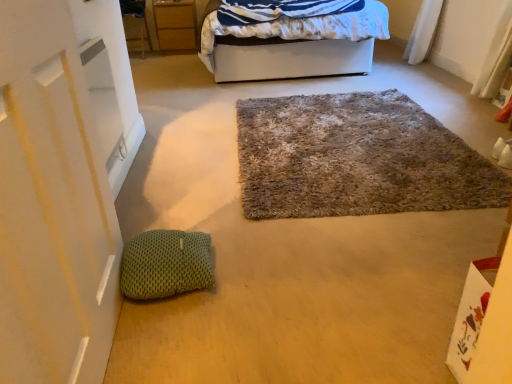
The height and width of the screenshot is (384, 512). Describe the element at coordinates (292, 45) in the screenshot. I see `white fabric bed at upper center` at that location.

You are a GUI agent. You are given a task and a screenshot of the screen. Output one action in this format:
    pyautogui.click(x=<x>, y=<y>)
    Task: Click on the white fabric bed at upper center
    
    Given the screenshot: What is the action you would take?
    pyautogui.click(x=292, y=45)

Image resolution: width=512 pixels, height=384 pixels. In order to click on bed above the green knitted pillow at lower left (from a real-world perspective) in this screenshot , I will do `click(292, 45)`.

Consider the image. Is white fabric bed at upper center beside green knitted pillow at lower left?

white fabric bed at upper center and green knitted pillow at lower left are clearly separated.

Could you tell me if white fabric bed at upper center is facing green knitted pillow at lower left?

Yes.

In the scene shown: Who is bigger, white fabric bed at upper center or green knitted pillow at lower left?

Bigger between the two is white fabric bed at upper center.

Are green knitted pillow at lower left and matte wood cabinet at upper left far apart?

Yes, green knitted pillow at lower left and matte wood cabinet at upper left are located far from each other.

You are a GUI agent. You are given a task and a screenshot of the screen. Output one action in this format:
    pyautogui.click(x=<x>, y=<y>)
    Task: Click on the pillow located below the matte wood cabinet at upper left (from the image's perspective)
    Image resolution: width=512 pixels, height=384 pixels.
    Given the screenshot: What is the action you would take?
    pyautogui.click(x=165, y=264)

From a real-world perspective, which is physically above, green knitted pillow at lower left or matte wood cabinet at upper left?

In real-world perspective, matte wood cabinet at upper left is above.

From the image's perspective, does white fabric bed at upper center appear lower than matte wood cabinet at upper left?

Yes, from the image's perspective, white fabric bed at upper center is below matte wood cabinet at upper left.

Would you consider white fabric bed at upper center to be distant from matte wood cabinet at upper left?

Yes, white fabric bed at upper center and matte wood cabinet at upper left are located far from each other.

Which is correct: white fabric bed at upper center is inside matte wood cabinet at upper left, or outside of it?

white fabric bed at upper center is not inside matte wood cabinet at upper left, it's outside.

Could you tell me if white fabric bed at upper center is facing matte wood cabinet at upper left?

No, white fabric bed at upper center does not turn towards matte wood cabinet at upper left.

What's the angular difference between fuzzy carpet at center and white fabric bed at upper center's facing directions?

The angular difference between fuzzy carpet at center and white fabric bed at upper center is 0.249 degrees.

Considering the relative sizes of fuzzy carpet at center and white fabric bed at upper center in the image provided, is fuzzy carpet at center bigger than white fabric bed at upper center?

Incorrect, fuzzy carpet at center is not larger than white fabric bed at upper center.

I want to click on door directly beneath the white fabric bed at upper center (from a real-world perspective), so click(357, 159).

Considering the sizes of objects fuzzy carpet at center and white fabric bed at upper center in the image provided, who is thinner, fuzzy carpet at center or white fabric bed at upper center?

Thinner between the two is fuzzy carpet at center.

Looking at this image, from a real-world perspective, which object rests below the other?

From a 3D spatial view, fuzzy carpet at center is below.

Would you consider white fabric bed at upper center to be distant from fuzzy carpet at center?

Indeed, white fabric bed at upper center is not near fuzzy carpet at center.

Considering the relative sizes of white fabric bed at upper center and fuzzy carpet at center in the image provided, is white fabric bed at upper center smaller than fuzzy carpet at center?

No, white fabric bed at upper center is not smaller than fuzzy carpet at center.

Does point (143, 245) come closer to viewer compared to point (264, 40)?

Yes, it is.

Based on the photo, does green knitted pillow at lower left lie behind white fabric bed at upper center?

No, green knitted pillow at lower left is closer to the camera.

Between green knitted pillow at lower left and white fabric bed at upper center, which one has more height?

With more height is white fabric bed at upper center.

What's the angular difference between matte wood cabinet at upper left and fuzzy carpet at center's facing directions?

The angular difference between matte wood cabinet at upper left and fuzzy carpet at center is 1.13 degrees.

Is point (173, 36) closer to camera compared to point (467, 196)?

No.

Can you confirm if matte wood cabinet at upper left is bigger than fuzzy carpet at center?

Incorrect, matte wood cabinet at upper left is not larger than fuzzy carpet at center.

Which of these two, matte wood cabinet at upper left or fuzzy carpet at center, is thinner?

matte wood cabinet at upper left is thinner.

Locate an element on the screen. pillow on the left of white fabric bed at upper center is located at coordinates (165, 264).

Find the location of a particular element. The image size is (512, 384). cabinetry located above the green knitted pillow at lower left (from the image's perspective) is located at coordinates (175, 25).

When comparing their distances from fuzzy carpet at center, does white fabric bed at upper center or matte wood cabinet at upper left seem closer?

The object closer to fuzzy carpet at center is white fabric bed at upper center.

Looking at this image, which object lies nearer to the anchor point fuzzy carpet at center, matte wood cabinet at upper left or green knitted pillow at lower left?

green knitted pillow at lower left is closer to fuzzy carpet at center.

From the image, which object appears to be nearer to green knitted pillow at lower left, fuzzy carpet at center or white fabric bed at upper center?

Based on the image, fuzzy carpet at center appears to be nearer to green knitted pillow at lower left.

When comparing their distances from matte wood cabinet at upper left, does green knitted pillow at lower left or fuzzy carpet at center seem closer?

fuzzy carpet at center is closer to matte wood cabinet at upper left.

Estimate the real-world distances between objects in this image. Which object is closer to fuzzy carpet at center, green knitted pillow at lower left or white fabric bed at upper center?

Among the two, green knitted pillow at lower left is located nearer to fuzzy carpet at center.

Estimate the real-world distances between objects in this image. Which object is further from green knitted pillow at lower left, matte wood cabinet at upper left or fuzzy carpet at center?

matte wood cabinet at upper left.

Looking at the image, which one is located closer to fuzzy carpet at center, matte wood cabinet at upper left or white fabric bed at upper center?

white fabric bed at upper center is closer to fuzzy carpet at center.

Considering their positions, is fuzzy carpet at center positioned closer to green knitted pillow at lower left than matte wood cabinet at upper left?

fuzzy carpet at center is positioned closer to the anchor green knitted pillow at lower left.

This screenshot has width=512, height=384. In order to click on door located between green knitted pillow at lower left and white fabric bed at upper center in the depth direction in this screenshot , I will do `click(357, 159)`.

This screenshot has height=384, width=512. Find the location of `bed between fuzzy carpet at center and matte wood cabinet at upper left from front to back`. bed between fuzzy carpet at center and matte wood cabinet at upper left from front to back is located at coordinates (292, 45).

Where is `bed positioned between green knitted pillow at lower left and matte wood cabinet at upper left from near to far`? The height and width of the screenshot is (384, 512). bed positioned between green knitted pillow at lower left and matte wood cabinet at upper left from near to far is located at coordinates (292, 45).

This screenshot has width=512, height=384. I want to click on door positioned between green knitted pillow at lower left and matte wood cabinet at upper left from near to far, so click(357, 159).